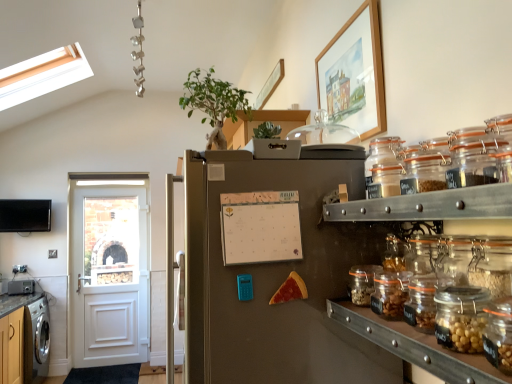
Question: Considering the relative sizes of clear glass jars at right and stainless steel refrigerator at center in the image provided, is clear glass jars at right shorter than stainless steel refrigerator at center?

Choices:
 (A) yes
 (B) no

Answer: (A)

Question: From a real-world perspective, does clear glass jars at right stand above stainless steel refrigerator at center?

Choices:
 (A) no
 (B) yes

Answer: (B)

Question: From the image's perspective, is clear glass jars at right on stainless steel refrigerator at center?

Choices:
 (A) no
 (B) yes

Answer: (B)

Question: Is clear glass jars at right placed right next to stainless steel refrigerator at center?

Choices:
 (A) yes
 (B) no

Answer: (B)

Question: Is clear glass jars at right bigger than stainless steel refrigerator at center?

Choices:
 (A) yes
 (B) no

Answer: (B)

Question: From the image's perspective, is clear glass jars at right located beneath stainless steel refrigerator at center?

Choices:
 (A) no
 (B) yes

Answer: (A)

Question: From the image's perspective, is stainless steel refrigerator at center beneath cheesy pizza slice at center?

Choices:
 (A) yes
 (B) no

Answer: (A)

Question: From a real-world perspective, is stainless steel refrigerator at center physically below cheesy pizza slice at center?

Choices:
 (A) no
 (B) yes

Answer: (B)

Question: Considering the relative sizes of stainless steel refrigerator at center and cheesy pizza slice at center in the image provided, is stainless steel refrigerator at center taller than cheesy pizza slice at center?

Choices:
 (A) yes
 (B) no

Answer: (A)

Question: Is stainless steel refrigerator at center positioned with its back to cheesy pizza slice at center?

Choices:
 (A) no
 (B) yes

Answer: (A)

Question: Is stainless steel refrigerator at center to the left of cheesy pizza slice at center from the viewer's perspective?

Choices:
 (A) yes
 (B) no

Answer: (A)

Question: Can you confirm if stainless steel refrigerator at center is bigger than cheesy pizza slice at center?

Choices:
 (A) no
 (B) yes

Answer: (B)

Question: Is stainless steel refrigerator at center oriented away from green leafy plant at upper center?

Choices:
 (A) no
 (B) yes

Answer: (A)